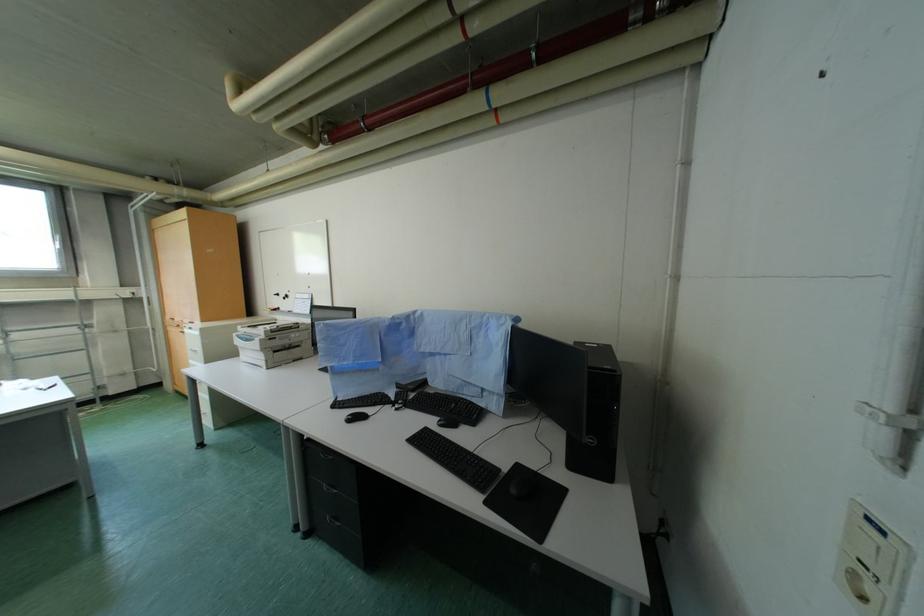
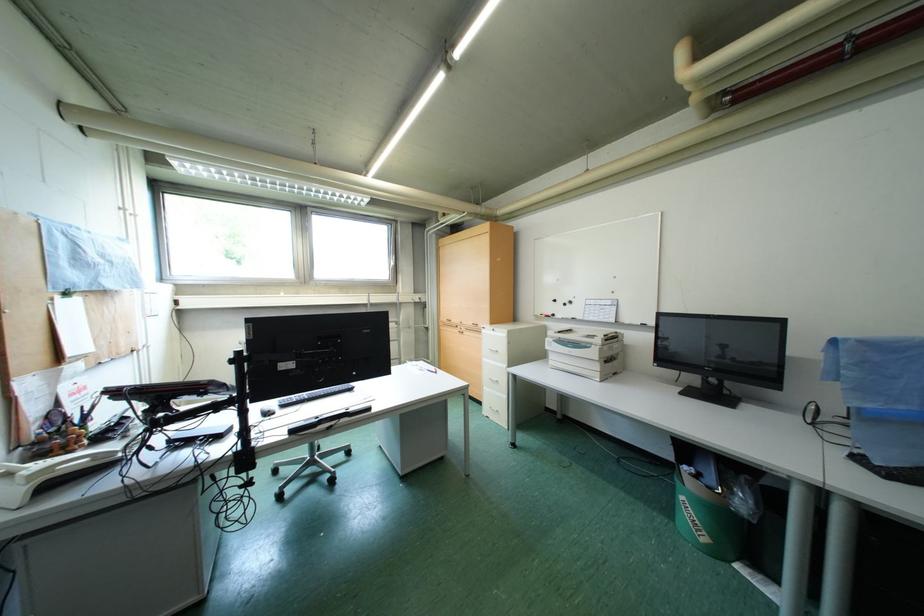
Question: What movement of the cameraman would produce the second image?

Choices:
 (A) Left
 (B) Right
 (C) Forward
 (D) Backward

Answer: (A)